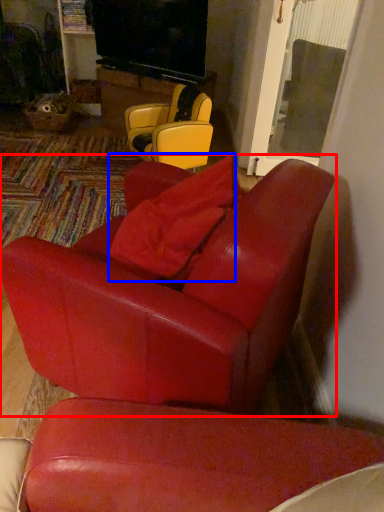
Question: Among these objects, which one is farthest to the camera, chair (highlighted by a red box) or pillow (highlighted by a blue box)?

Choices:
 (A) chair
 (B) pillow

Answer: (B)